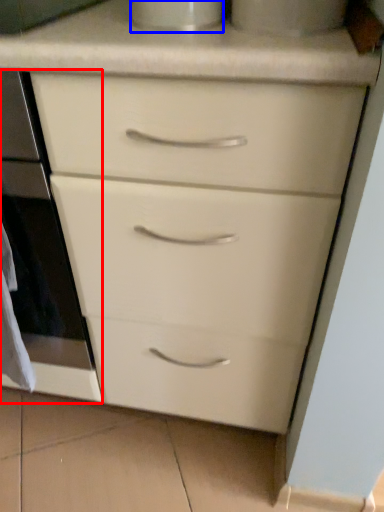
Question: Which of the following is the farthest to the observer, oven (highlighted by a red box) or appliance (highlighted by a blue box)?

Choices:
 (A) oven
 (B) appliance

Answer: (A)